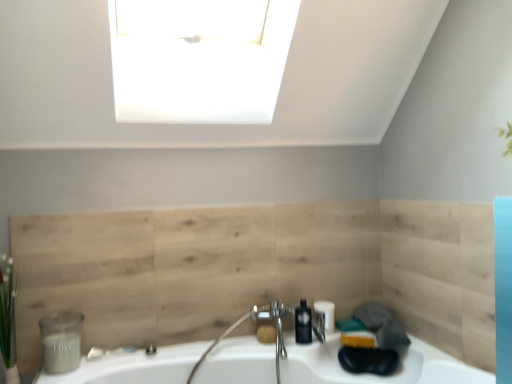
Question: Considering the relative sizes of matte brown soap at center and matte gray container at lower left, marked as the first toiletry in a left-to-right arrangement, in the image provided, is matte brown soap at center smaller than matte gray container at lower left, marked as the first toiletry in a left-to-right arrangement,?

Choices:
 (A) no
 (B) yes

Answer: (B)

Question: From a real-world perspective, does matte brown soap at center sit lower than matte gray container at lower left, marked as the first toiletry in a left-to-right arrangement?

Choices:
 (A) yes
 (B) no

Answer: (A)

Question: Would you say matte brown soap at center is a long distance from matte gray container at lower left, the second toiletry in the back-to-front sequence?

Choices:
 (A) no
 (B) yes

Answer: (A)

Question: Can you confirm if matte brown soap at center is positioned to the right of matte gray container at lower left, the second toiletry positioned from the right?

Choices:
 (A) yes
 (B) no

Answer: (A)

Question: Is matte brown soap at center looking in the opposite direction of matte gray container at lower left, the second toiletry positioned from the right?

Choices:
 (A) yes
 (B) no

Answer: (B)

Question: Can you confirm if matte brown soap at center is shorter than matte gray container at lower left, the second toiletry positioned from the right?

Choices:
 (A) yes
 (B) no

Answer: (A)

Question: From the image's perspective, is matte black toiletry at lower center, the first toiletry viewed from the right, on white glossy sink at lower center?

Choices:
 (A) yes
 (B) no

Answer: (A)

Question: Considering the relative sizes of matte black toiletry at lower center, acting as the 2th toiletry starting from the front, and white glossy sink at lower center in the image provided, is matte black toiletry at lower center, acting as the 2th toiletry starting from the front, bigger than white glossy sink at lower center?

Choices:
 (A) yes
 (B) no

Answer: (B)

Question: Does matte black toiletry at lower center, acting as the 2th toiletry starting from the front, turn towards white glossy sink at lower center?

Choices:
 (A) yes
 (B) no

Answer: (B)

Question: Can you confirm if matte black toiletry at lower center, acting as the first toiletry starting from the back, is positioned to the left of white glossy sink at lower center?

Choices:
 (A) no
 (B) yes

Answer: (A)

Question: Does matte black toiletry at lower center, acting as the first toiletry starting from the back, have a greater height compared to white glossy sink at lower center?

Choices:
 (A) no
 (B) yes

Answer: (A)

Question: From the image's perspective, would you say matte black toiletry at lower center, arranged as the second toiletry when viewed from the left, is shown under white glossy sink at lower center?

Choices:
 (A) no
 (B) yes

Answer: (A)

Question: Is matte gray container at lower left, the 1th toiletry when ordered from front to back, wider than green leafy plant at left?

Choices:
 (A) no
 (B) yes

Answer: (A)